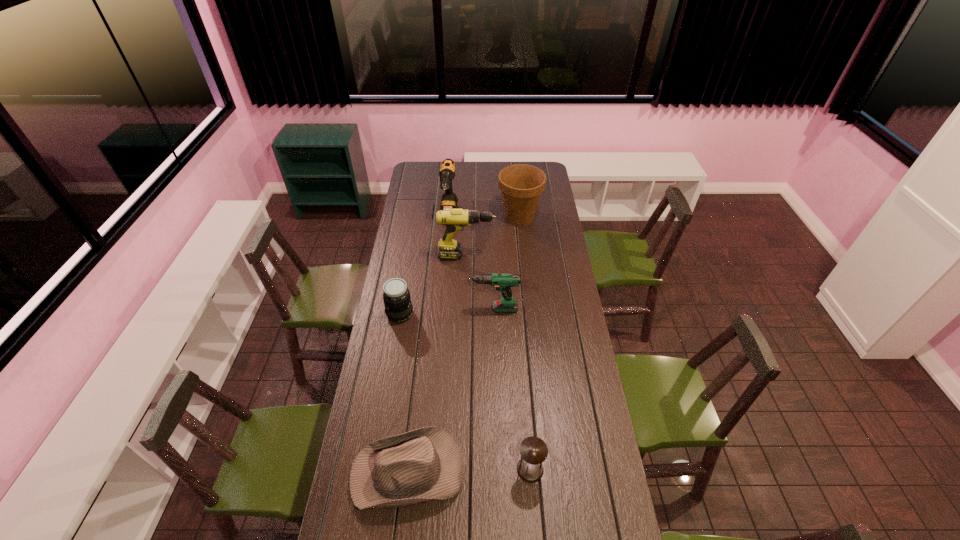
This screenshot has height=540, width=960. I want to click on vacant space at the left edge of the desktop, so click(x=419, y=226).

This screenshot has height=540, width=960. Identify the location of vacant region at the right edge. (564, 253).

Where is `free spot between the telephoto lens and the fourth shortest object`? The image size is (960, 540). free spot between the telephoto lens and the fourth shortest object is located at coordinates (445, 311).

You are a GUI agent. You are given a task and a screenshot of the screen. Output one action in this format:
    pyautogui.click(x=<x>, y=<y>)
    Task: Click on the free spot between the third farthest object and the hourglass
    This screenshot has width=960, height=540.
    Given the screenshot: What is the action you would take?
    pyautogui.click(x=498, y=363)

Locate an element on the screen. The width and height of the screenshot is (960, 540). vacant area between the third farthest object and the fedora is located at coordinates (437, 363).

The width and height of the screenshot is (960, 540). I want to click on vacant point located between the flowerpot and the third shortest object, so click(460, 265).

Where is `vacant space that is in between the telephoto lens and the third farthest object`? This screenshot has height=540, width=960. vacant space that is in between the telephoto lens and the third farthest object is located at coordinates (433, 285).

Locate an element on the screen. Image resolution: width=960 pixels, height=540 pixels. object that is the closest one to the fedora is located at coordinates (533, 450).

Where is `the second closest object relative to the telephoto lens`? This screenshot has height=540, width=960. the second closest object relative to the telephoto lens is located at coordinates (455, 219).

Identify the location of the closest drill relative to the fifth nearest object. (449, 201).